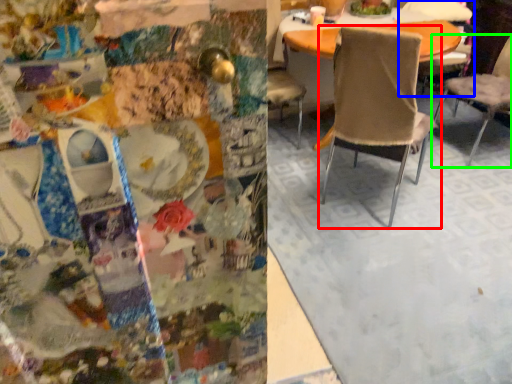
Question: Based on their relative distances, which object is farther from chair (highlighted by a red box)? Choose from chair (highlighted by a blue box) and chair (highlighted by a green box).

Choices:
 (A) chair
 (B) chair

Answer: (A)